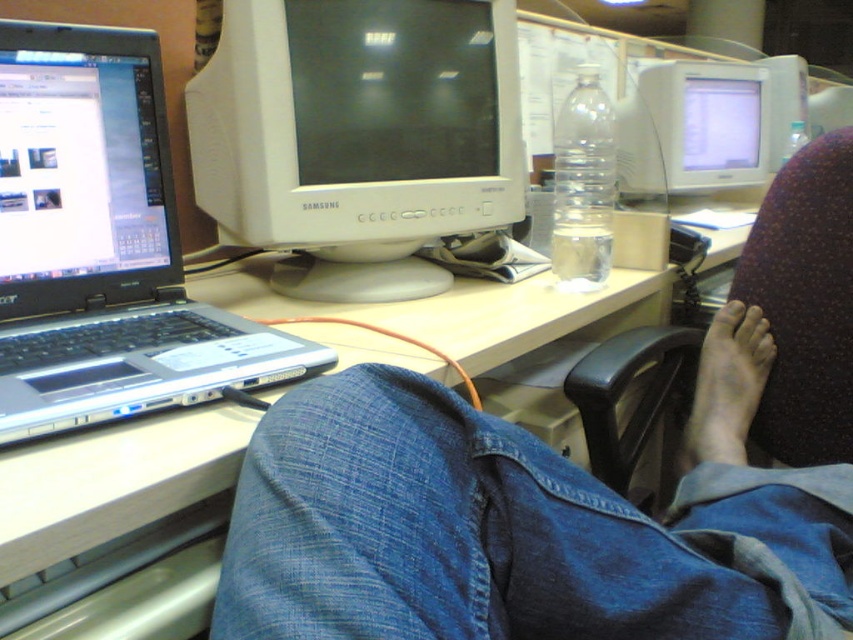
Looking at this image, who is shorter, matte plastic computer desk at center or dry skin foot at lower right?

dry skin foot at lower right is shorter.

Can you confirm if matte plastic computer desk at center is thinner than dry skin foot at lower right?

In fact, matte plastic computer desk at center might be wider than dry skin foot at lower right.

Is point (136, 612) closer to viewer compared to point (714, 381)?

Yes.

I want to click on matte plastic computer desk at center, so click(119, 525).

Is white plastic monitor at center shorter than matte plastic computer desk at center?

No.

Does white plastic monitor at center have a larger size compared to matte plastic computer desk at center?

No, white plastic monitor at center is not bigger than matte plastic computer desk at center.

Does point (326, 67) come farther from viewer compared to point (167, 563)?

Yes, it is.

Locate an element on the screen. The height and width of the screenshot is (640, 853). white plastic monitor at center is located at coordinates (358, 136).

From the picture: Is white plastic monitor at center to the left of silver metallic laptop at left from the viewer's perspective?

No, white plastic monitor at center is not to the left of silver metallic laptop at left.

Which is more to the left, white plastic monitor at center or silver metallic laptop at left?

Positioned to the left is silver metallic laptop at left.

The height and width of the screenshot is (640, 853). What do you see at coordinates (358, 136) in the screenshot? I see `white plastic monitor at center` at bounding box center [358, 136].

Where is `white plastic monitor at center`? Image resolution: width=853 pixels, height=640 pixels. white plastic monitor at center is located at coordinates point(358,136).